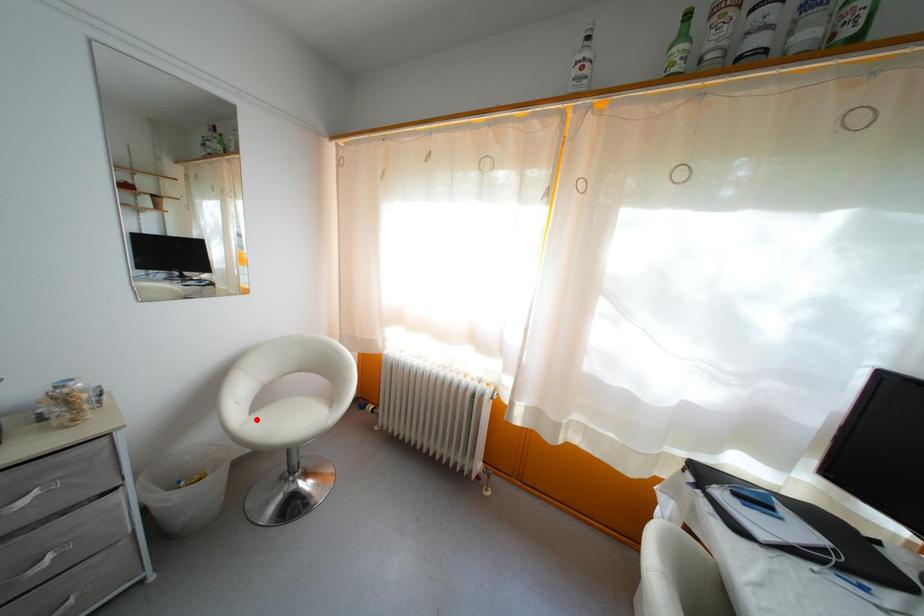
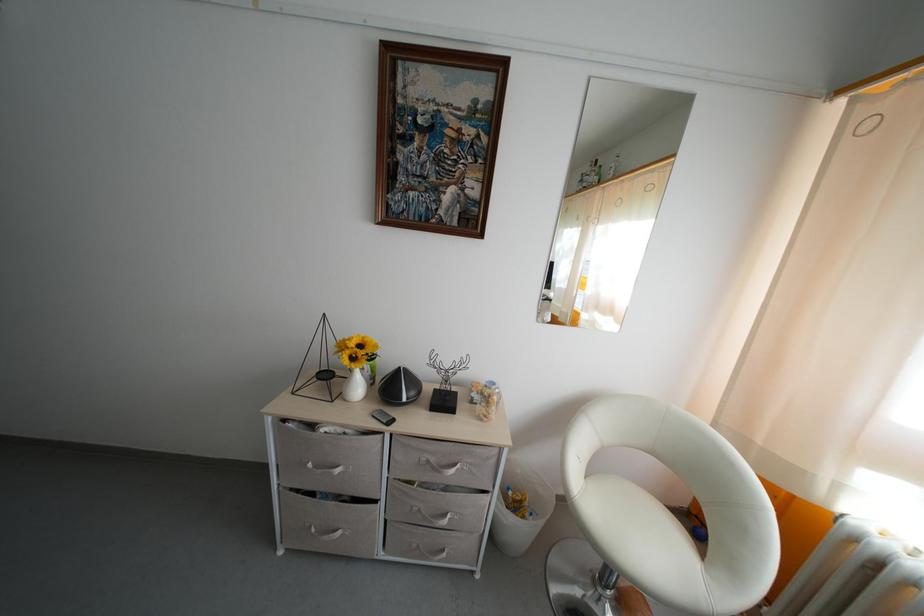
Find the pixel in the second image that matches the highlighted location in the first image.

(591, 484)